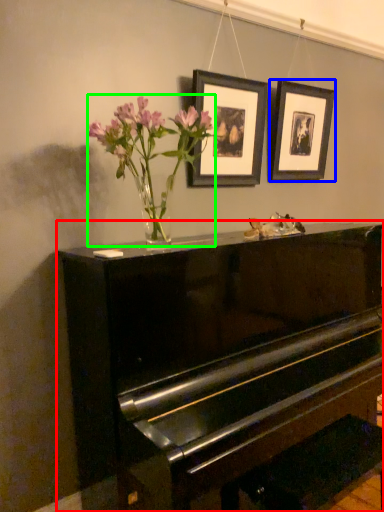
Question: Which object is positioned farthest from piano (highlighted by a red box)? Select from picture frame (highlighted by a blue box) and floral arrangement (highlighted by a green box).

Choices:
 (A) picture frame
 (B) floral arrangement

Answer: (A)